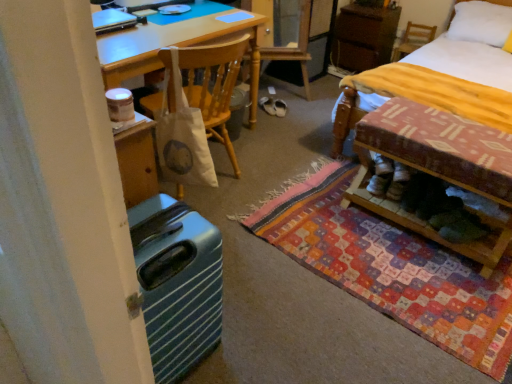
This screenshot has width=512, height=384. I want to click on free location to the right of white fabric shoe at center, the first footwear viewed from the right, so click(304, 110).